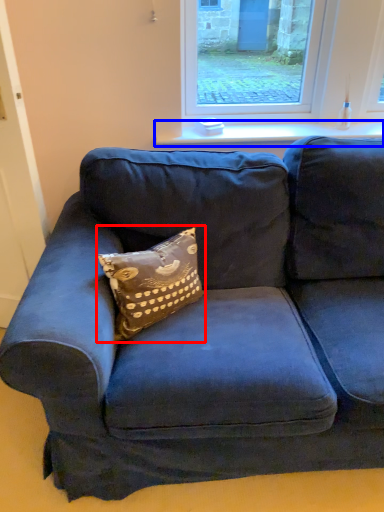
Question: Among these objects, which one is nearest to the camera, pillow (highlighted by a red box) or window sill (highlighted by a blue box)?

Choices:
 (A) pillow
 (B) window sill

Answer: (A)